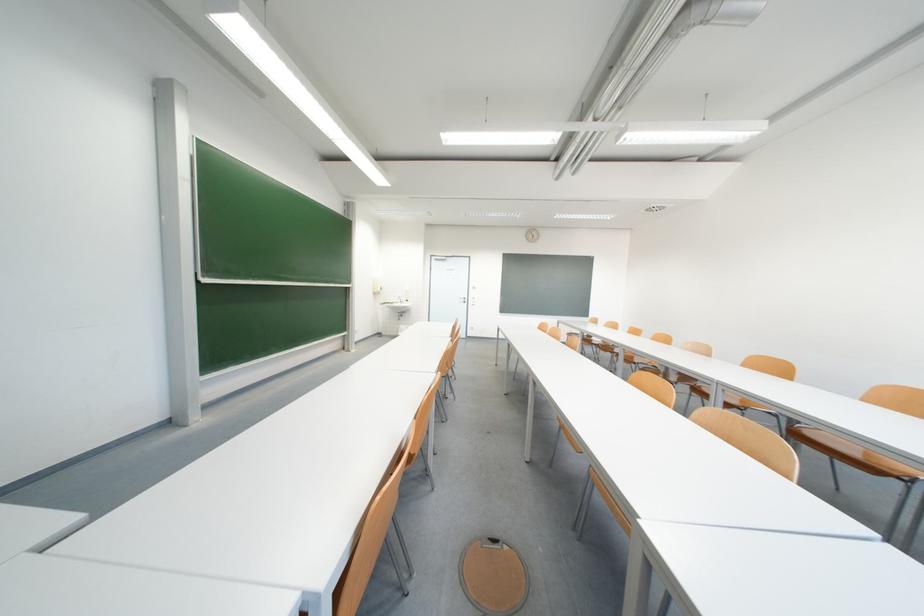
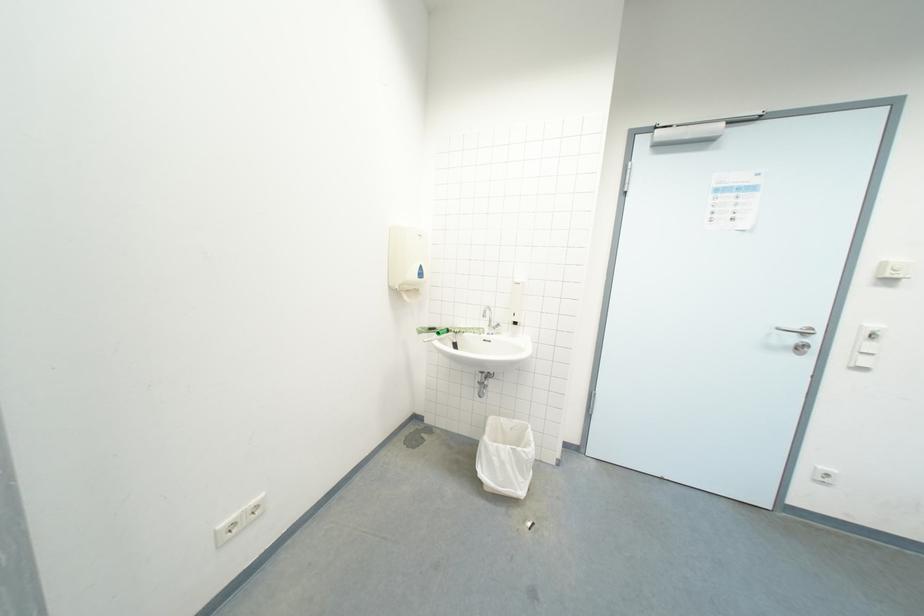
Where in the second image is the point corresponding to (x=411, y=301) from the first image?

(511, 318)